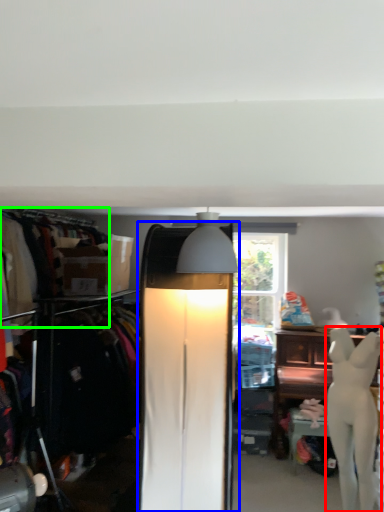
Question: Estimate the real-world distances between objects in this image. Which object is closer to mannequin (highlighted by a red box), lamp (highlighted by a blue box) or clothing (highlighted by a green box)?

Choices:
 (A) lamp
 (B) clothing

Answer: (A)